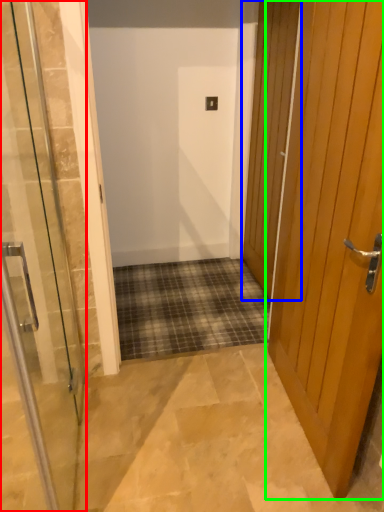
Question: Which is farther away from door (highlighted by a red box)? door (highlighted by a blue box) or door (highlighted by a green box)?

Choices:
 (A) door
 (B) door

Answer: (A)